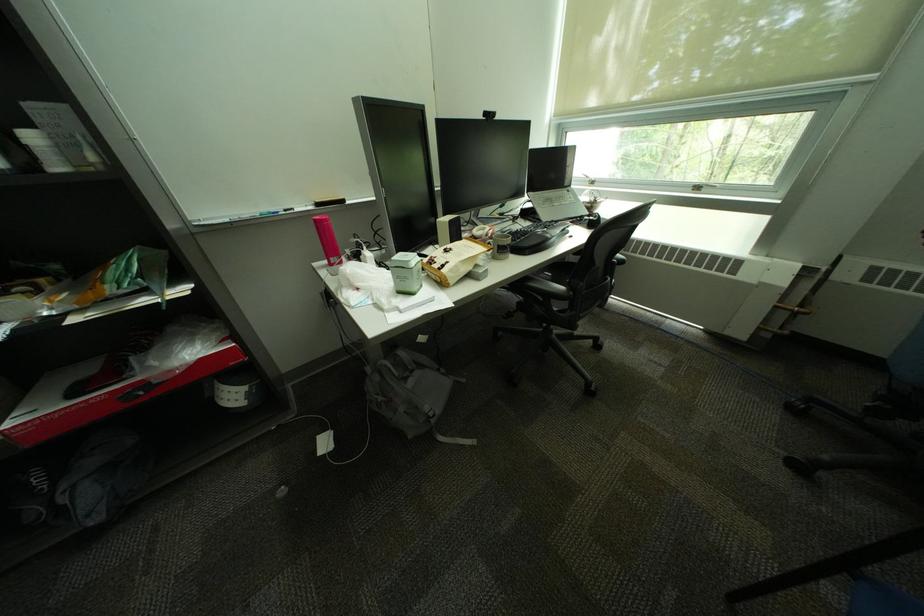
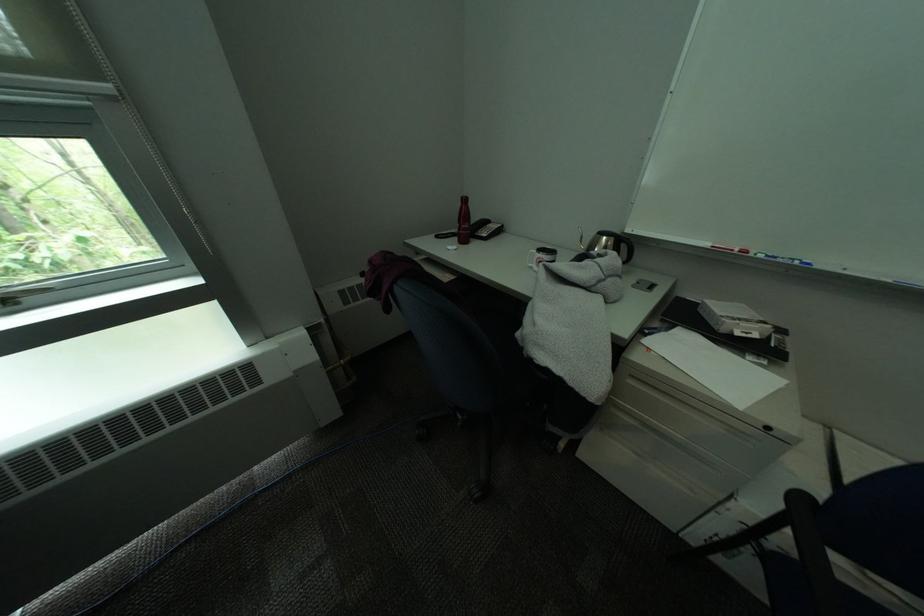
Locate, in the second image, the point that corresponds to point (888, 76) in the first image.

(119, 87)